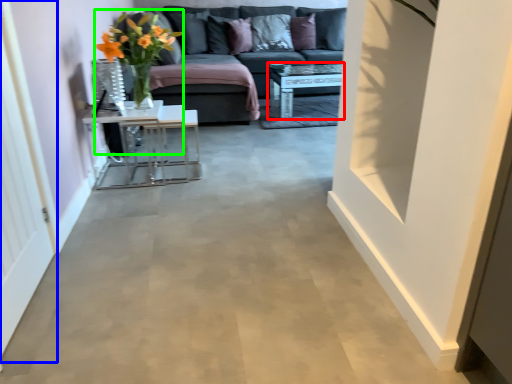
Question: Estimate the real-world distances between objects in this image. Which object is farther from table (highlighted by a red box), glass door (highlighted by a blue box) or floral arrangement (highlighted by a green box)?

Choices:
 (A) glass door
 (B) floral arrangement

Answer: (A)